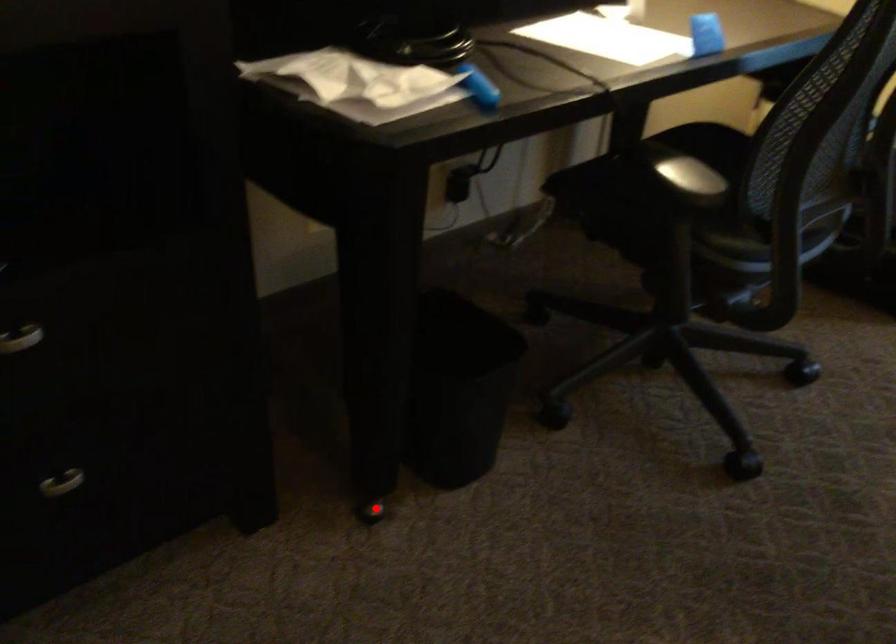
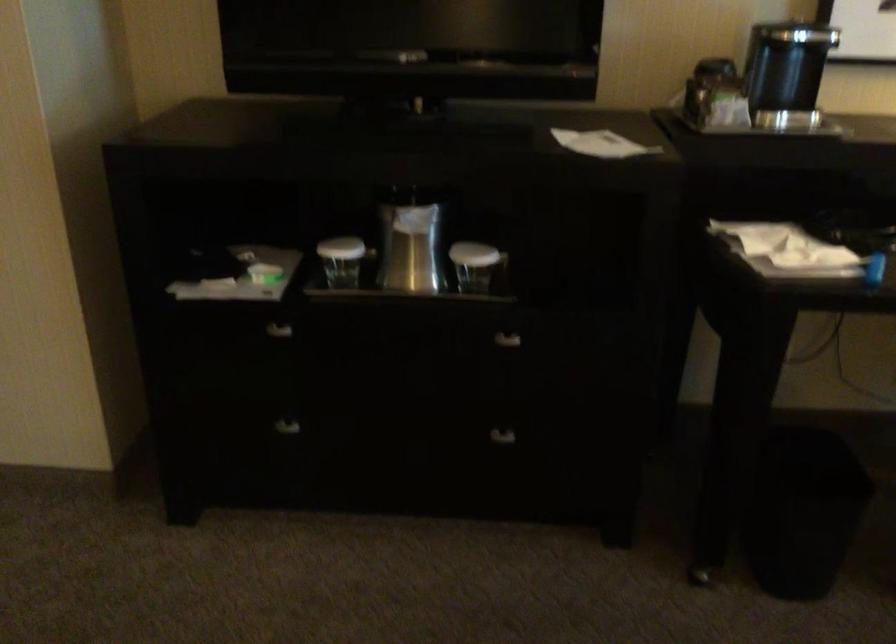
Question: I am providing you with two images of the same scene from different viewpoints. A red point is marked on the first image. Is the red point's position out of view in image 2?

Choices:
 (A) Yes
 (B) No

Answer: (B)